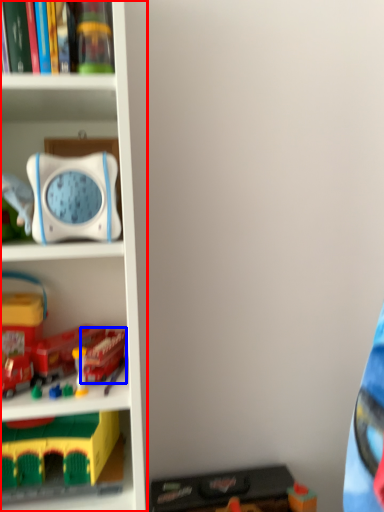
Question: Which point is closer to the camera, bookcase (highlighted by a red box) or toy (highlighted by a blue box)?

Choices:
 (A) bookcase
 (B) toy

Answer: (A)